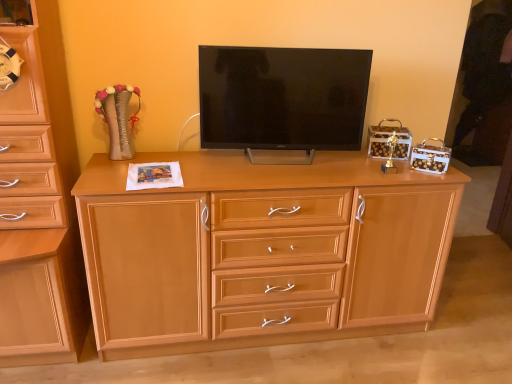
Locate an element on the screen. The height and width of the screenshot is (384, 512). vacant area that is in front of matte black tv at center is located at coordinates (274, 174).